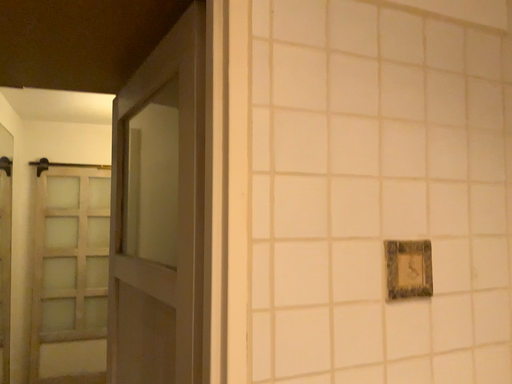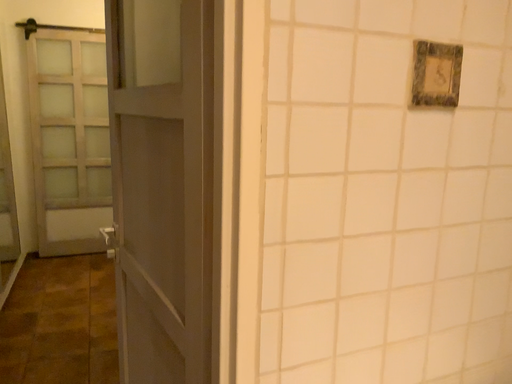
Question: Which way did the camera rotate in the video?

Choices:
 (A) rotated upward
 (B) rotated downward

Answer: (B)